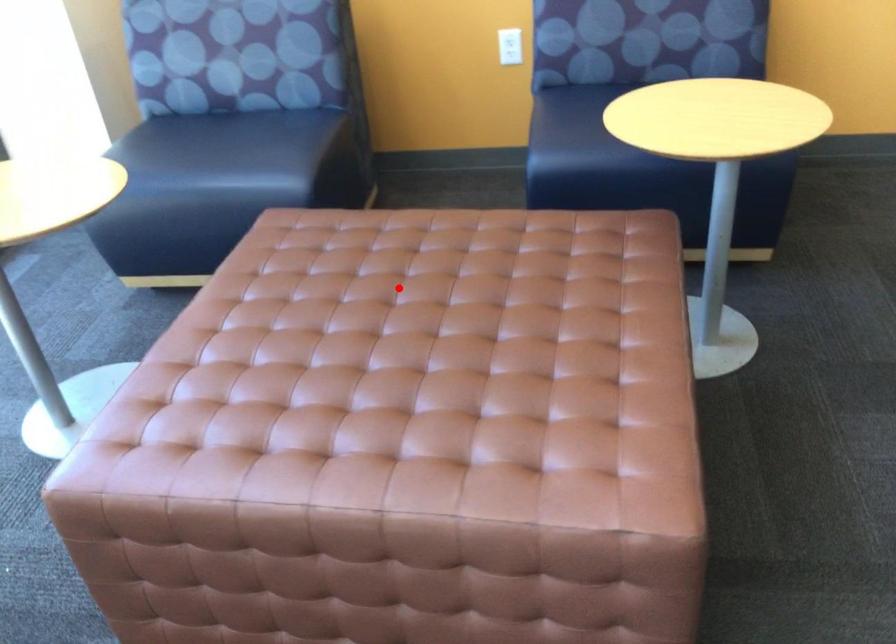
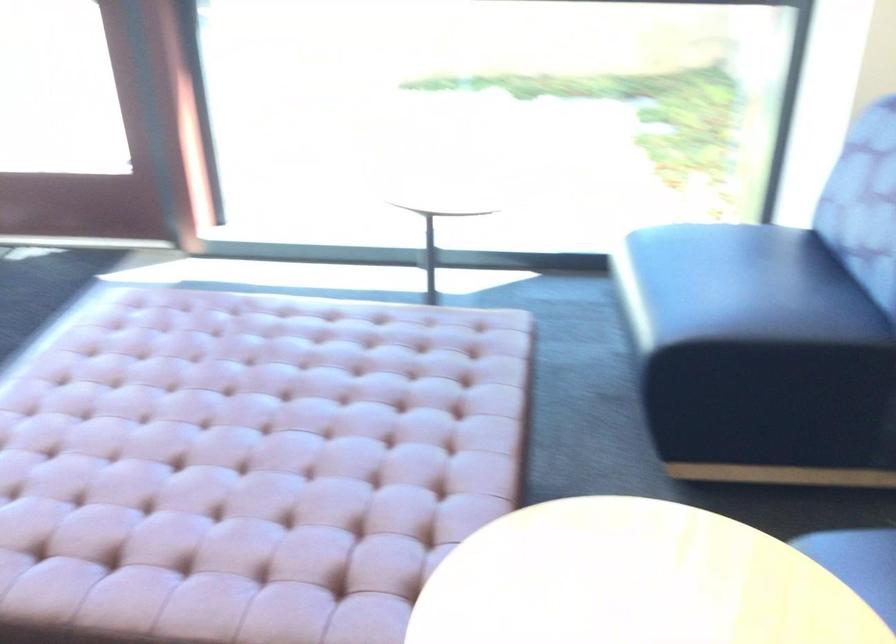
Find the pixel in the second image that matches the highlighted location in the first image.

(306, 406)